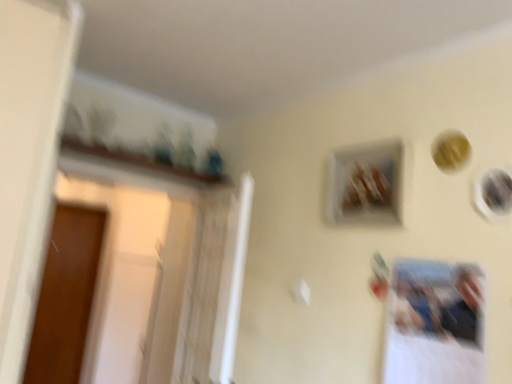
Question: Should I look upward or downward to see matte black picture frame at upper right, the 2th picture frame viewed from the left?

Choices:
 (A) up
 (B) down

Answer: (B)

Question: Does wooden frame at upper center, placed as the 2th picture frame when sorted from front to back, have a smaller size compared to brown wood screen door at left?

Choices:
 (A) yes
 (B) no

Answer: (A)

Question: From the image's perspective, is wooden frame at upper center, the 2th picture frame from the right, on brown wood screen door at left?

Choices:
 (A) no
 (B) yes

Answer: (B)

Question: Does wooden frame at upper center, the 2th picture frame from the right, have a lesser height compared to brown wood screen door at left?

Choices:
 (A) no
 (B) yes

Answer: (B)

Question: Considering the relative sizes of wooden frame at upper center, the 2th picture frame from the right, and brown wood screen door at left in the image provided, is wooden frame at upper center, the 2th picture frame from the right, thinner than brown wood screen door at left?

Choices:
 (A) yes
 (B) no

Answer: (A)

Question: Is wooden frame at upper center, the 1th picture frame from the back, outside brown wood screen door at left?

Choices:
 (A) yes
 (B) no

Answer: (A)

Question: From the image's perspective, is wooden frame at upper center, the 2th picture frame from the right, below brown wood screen door at left?

Choices:
 (A) yes
 (B) no

Answer: (B)

Question: From the image's perspective, is wooden frame at upper center, the first picture frame from the left, beneath matte black picture frame at upper right, the 2th picture frame viewed from the left?

Choices:
 (A) no
 (B) yes

Answer: (A)

Question: Can you confirm if wooden frame at upper center, the first picture frame from the left, is smaller than matte black picture frame at upper right, which is the first picture frame from front to back?

Choices:
 (A) yes
 (B) no

Answer: (B)

Question: Is wooden frame at upper center, the 1th picture frame from the back, far from matte black picture frame at upper right, which ranks as the 2th picture frame in back-to-front order?

Choices:
 (A) no
 (B) yes

Answer: (A)

Question: Could you tell me if wooden frame at upper center, the 2th picture frame from the right, is facing matte black picture frame at upper right, the 2th picture frame viewed from the left?

Choices:
 (A) no
 (B) yes

Answer: (A)

Question: From the image's perspective, is wooden frame at upper center, placed as the 2th picture frame when sorted from front to back, located above matte black picture frame at upper right, the 2th picture frame viewed from the left?

Choices:
 (A) no
 (B) yes

Answer: (B)

Question: Is the position of wooden frame at upper center, the first picture frame from the left, more distant than that of matte black picture frame at upper right, the 2th picture frame viewed from the left?

Choices:
 (A) yes
 (B) no

Answer: (A)

Question: Is brown wood screen door at left not near wooden frame at upper center, placed as the 2th picture frame when sorted from front to back?

Choices:
 (A) no
 (B) yes

Answer: (B)